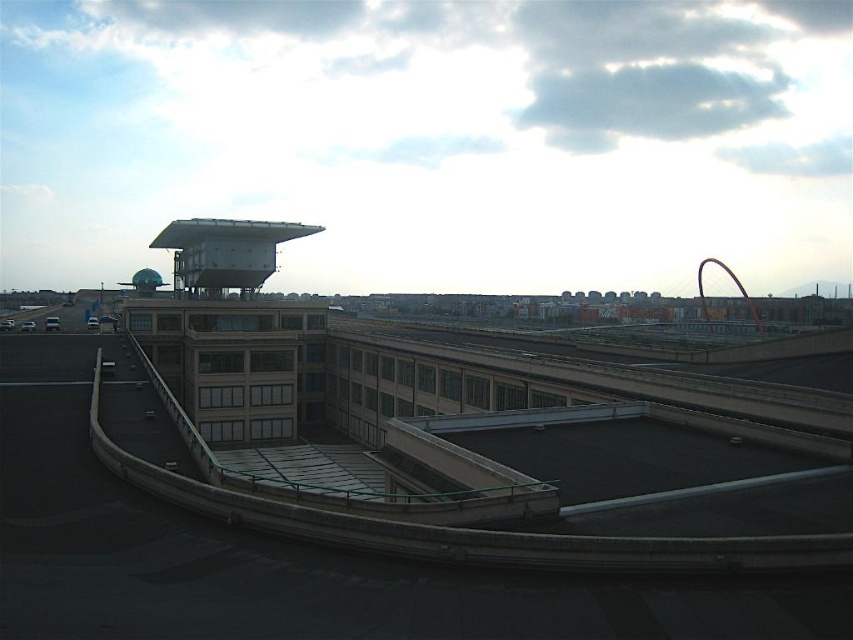
Can you confirm if metallic gray water tower at upper center is positioned to the left of metallic green water tower at upper left?

No, metallic gray water tower at upper center is not to the left of metallic green water tower at upper left.

Who is more distant from viewer, (x=268, y=243) or (x=137, y=285)?

The point (x=137, y=285) is more distant.

Find the location of `metallic gray water tower at upper center`. metallic gray water tower at upper center is located at coordinates (225, 252).